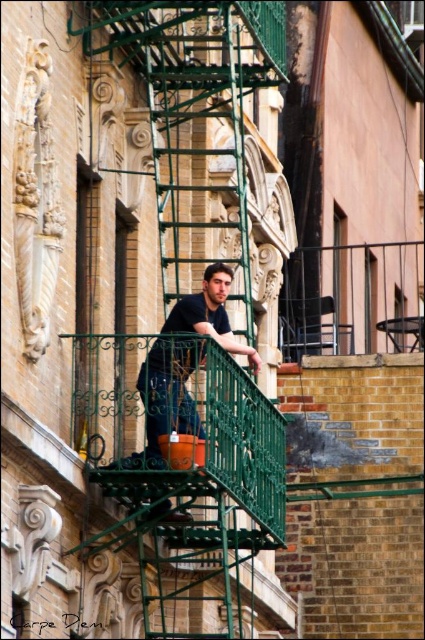
Between green metal fire escape at center and dark blue shirt at center, which one is positioned higher?

dark blue shirt at center is above.

Does green metal fire escape at center have a greater height compared to dark blue shirt at center?

Indeed, green metal fire escape at center has a greater height compared to dark blue shirt at center.

Who is more forward, (x=266, y=278) or (x=167, y=392)?

Point (x=167, y=392)

Where is `green metal fire escape at center`? The image size is (425, 640). green metal fire escape at center is located at coordinates (190, 330).